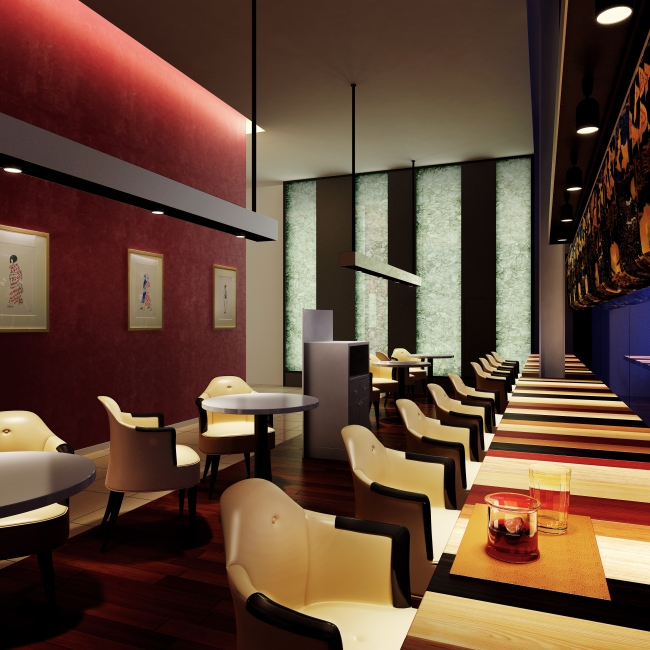
This screenshot has width=650, height=650. I want to click on glass window, so click(302, 233), click(367, 220), click(437, 226), click(513, 236).